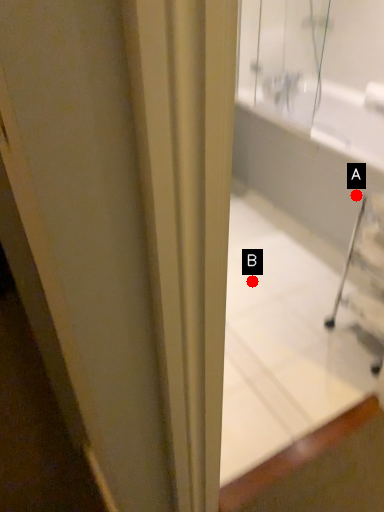
Question: Two points are circled on the image, labeled by A and B beside each circle. Which point appears farthest from the camera in this image?

Choices:
 (A) A is further
 (B) B is further

Answer: (B)